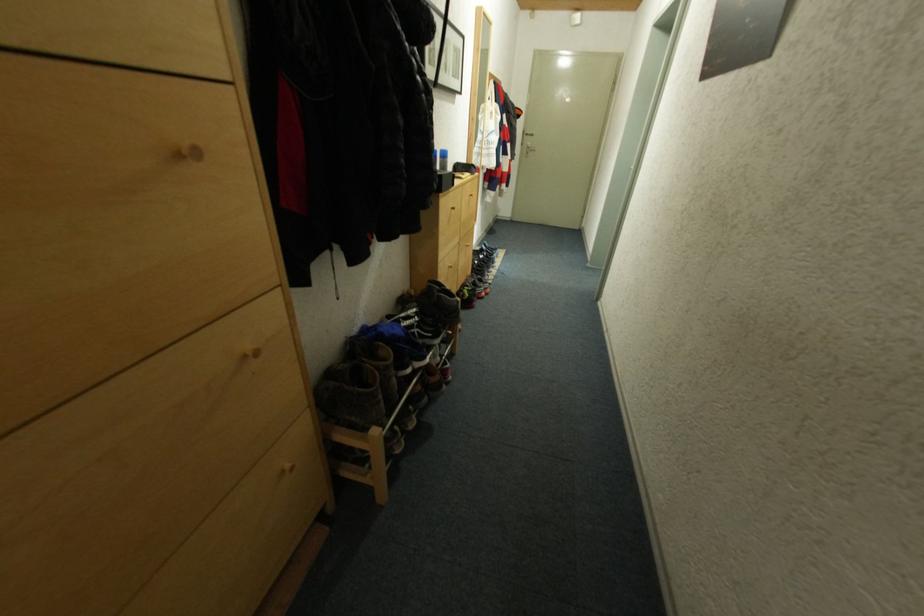
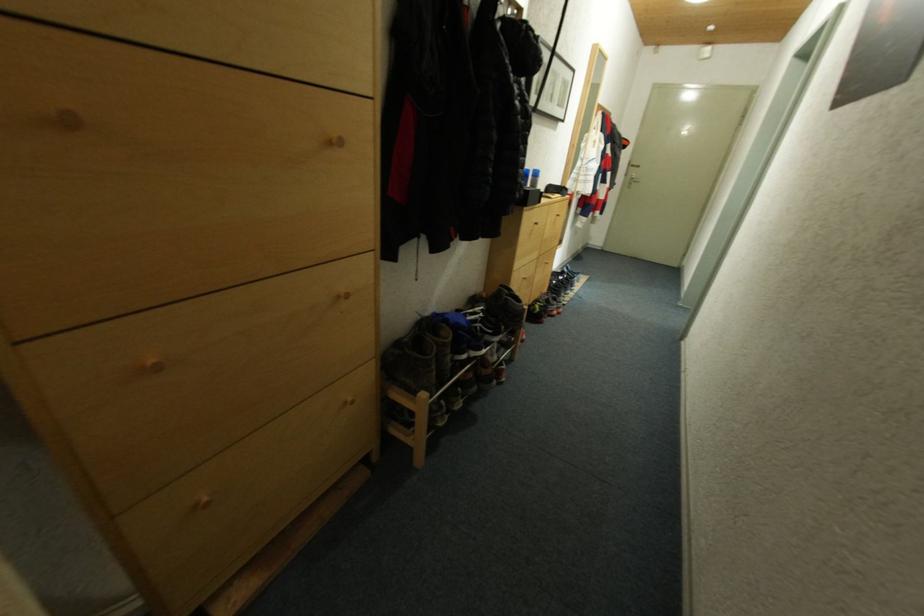
Question: The first image is from the beginning of the video and the second image is from the end. How did the camera likely rotate when shooting the video?

Choices:
 (A) Left
 (B) Right
 (C) Up
 (D) Down

Answer: (A)